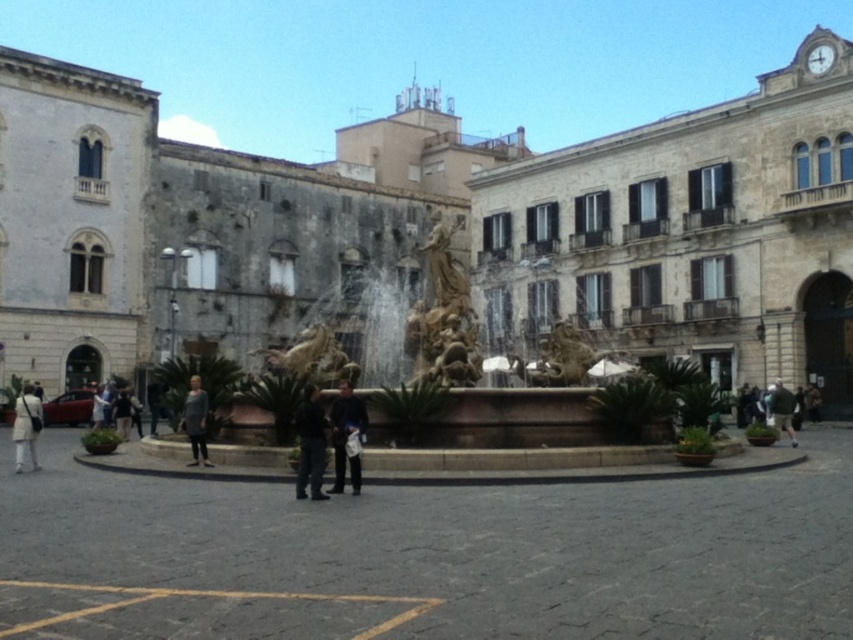
Which is more to the right, golden stone fountain at center or green fabric jacket at lower right?

green fabric jacket at lower right is more to the right.

How much distance is there between golden stone fountain at center and green fabric jacket at lower right?

golden stone fountain at center is 71.24 feet from green fabric jacket at lower right.

The image size is (853, 640). In order to click on golden stone fountain at center in this screenshot , I will do `click(444, 321)`.

Can you confirm if white stone building at upper right is thinner than light beige coat at lower left?

Incorrect, white stone building at upper right's width is not less than light beige coat at lower left's.

Is point (711, 244) positioned in front of point (24, 401)?

No, it is not.

This screenshot has height=640, width=853. What are the coordinates of `white stone building at upper right` in the screenshot? It's located at (689, 234).

Who is more distant from viewer, (811,246) or (314,465)?

Point (811,246)

Is white stone building at upper right below dark gray fabric pants at center?

Incorrect, white stone building at upper right is not positioned below dark gray fabric pants at center.

Locate an element on the screen. This screenshot has width=853, height=640. white stone building at upper right is located at coordinates (689, 234).

Find the location of a particular element. This screenshot has width=853, height=640. white stone building at upper right is located at coordinates (689, 234).